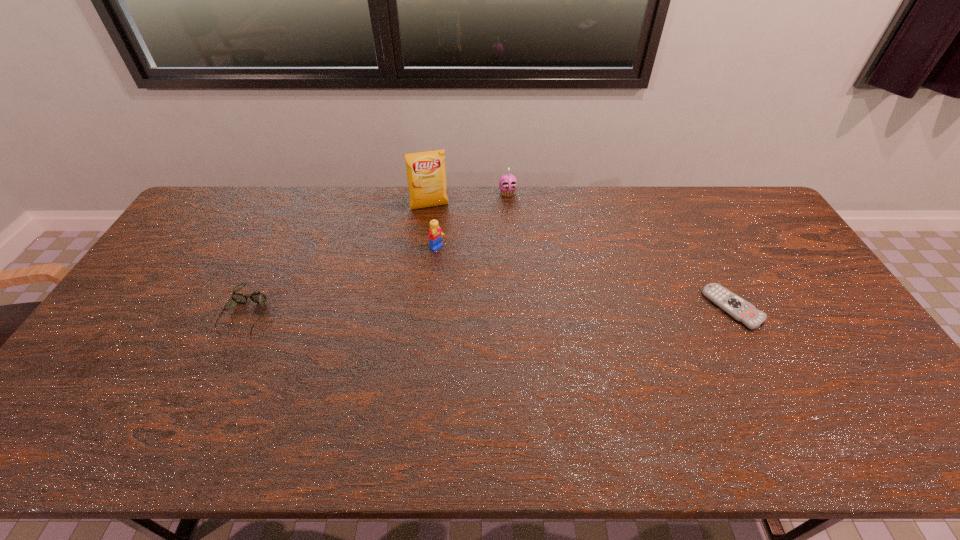
Identify the location of free space on the desktop that is between the fourth tallest object and the rightmost object and is positioned on the front of the tallest object with the logo. (459, 310).

Find the location of a particular element. The image size is (960, 540). vacant spot on the desktop that is between the leftmost object and the shortest object and is positioned on the face of the cupcake is located at coordinates (542, 309).

You are a GUI agent. You are given a task and a screenshot of the screen. Output one action in this format:
    pyautogui.click(x=<x>, y=<y>)
    Task: Click on the free spot on the desktop that is between the spectacles and the shortest object and is positioned on the face of the third farthest object
    This screenshot has height=540, width=960.
    Given the screenshot: What is the action you would take?
    pyautogui.click(x=520, y=310)